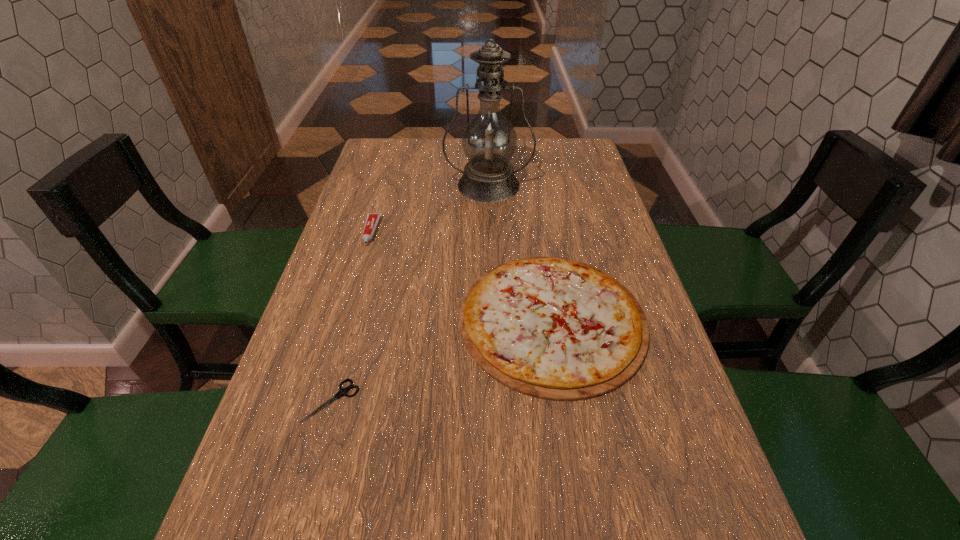
Where is `the farthest object`? the farthest object is located at coordinates (489, 140).

Where is `the tallest object`? Image resolution: width=960 pixels, height=540 pixels. the tallest object is located at coordinates (489, 140).

At what (x,y) coordinates should I click in order to perform the action: click on the second farthest object. Please return your answer as a coordinate pair (x, y). Looking at the image, I should click on (372, 220).

Identify the location of toothpaste. (372, 220).

This screenshot has height=540, width=960. I want to click on pizza, so click(553, 328).

You are a GUI agent. You are given a task and a screenshot of the screen. Output one action in this format:
    pyautogui.click(x=<x>, y=<y>)
    Task: Click on the shortest object
    This screenshot has height=540, width=960.
    Given the screenshot: What is the action you would take?
    pyautogui.click(x=342, y=391)

The height and width of the screenshot is (540, 960). What are the coordinates of `free region located 0.180m on the back of the farthest object` in the screenshot? It's located at (488, 144).

The height and width of the screenshot is (540, 960). I want to click on free space located 0.310m at the nozzle of the second tallest object, so click(339, 341).

This screenshot has width=960, height=540. Identify the location of free location located on the left of the pizza. (318, 320).

Image resolution: width=960 pixels, height=540 pixels. In order to click on free region located 0.350m on the right of the shortest object in this screenshot , I will do `click(546, 401)`.